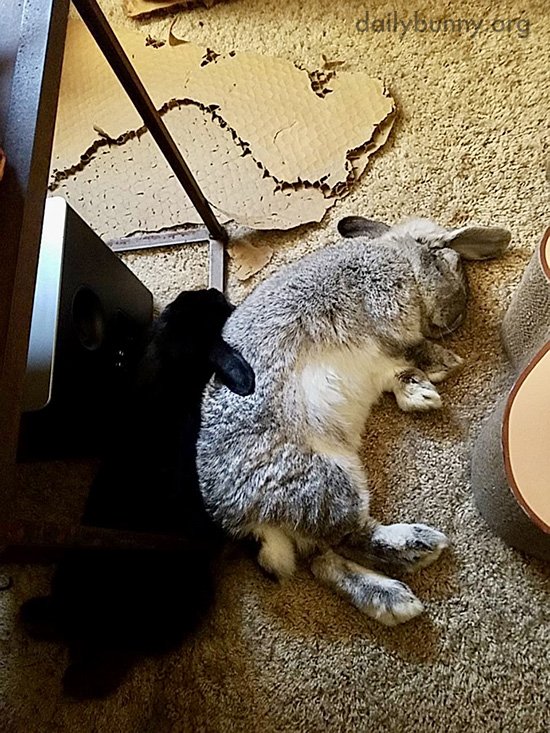
This screenshot has height=733, width=550. In order to click on rug in this screenshot , I will do `click(434, 624)`.